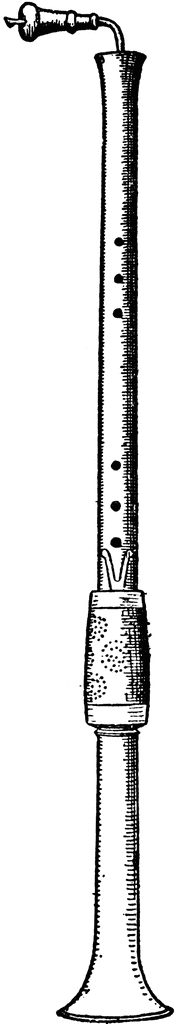
Where is `handle`? handle is located at coordinates (57, 20).